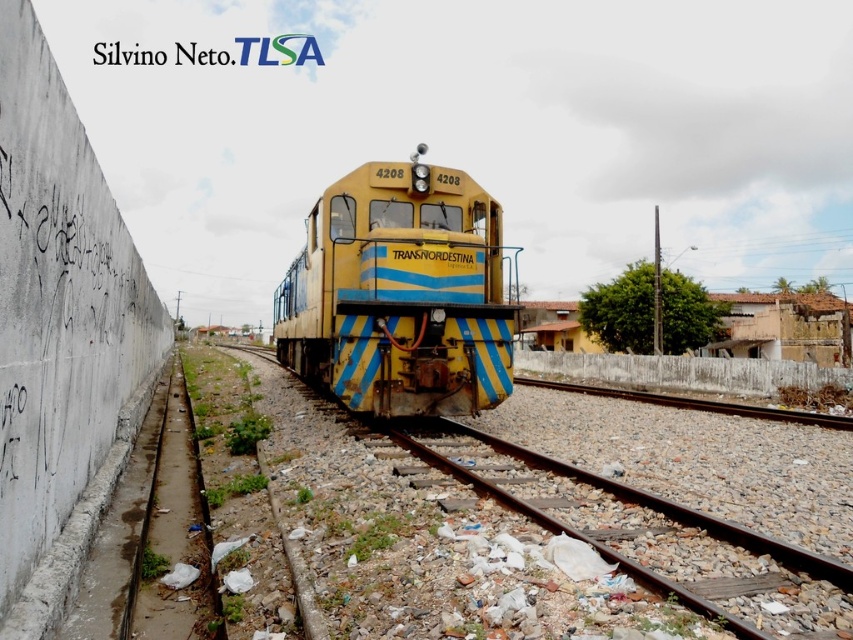
Which is behind, point (500, 241) or point (619, 531)?

Point (500, 241)

Which is more to the left, yellow matte train at center or rusty metal train track at center?

Positioned to the left is yellow matte train at center.

What do you see at coordinates (399, 292) in the screenshot? This screenshot has height=640, width=853. I see `yellow matte train at center` at bounding box center [399, 292].

Locate an element on the screen. The height and width of the screenshot is (640, 853). yellow matte train at center is located at coordinates (399, 292).